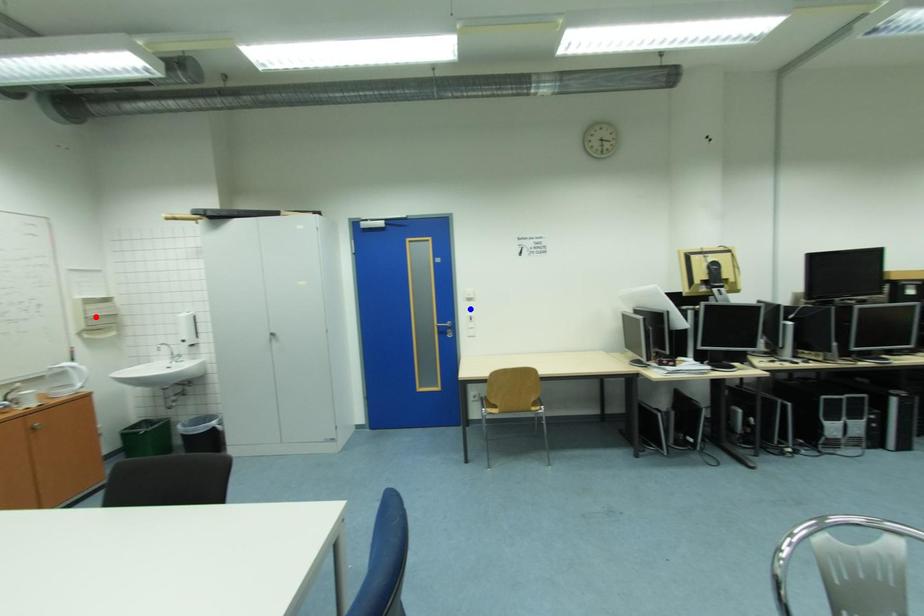
Question: In the image, two points are highlighted. Which point is nearer to the camera? Reply with the corresponding letter.

Choices:
 (A) blue point
 (B) red point

Answer: (B)